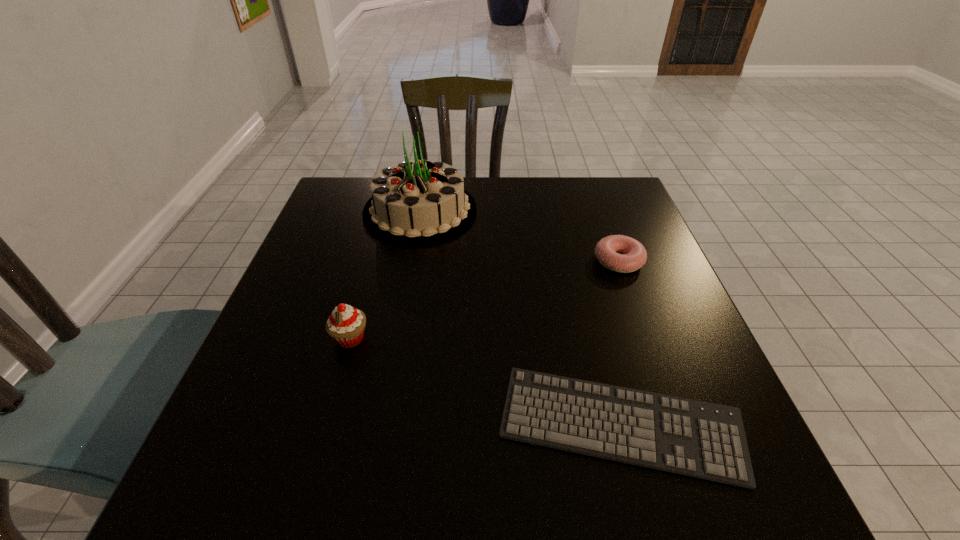
In the image, there is a desktop. At what (x,y) coordinates should I click in order to perform the action: click on vacant space at the left edge. Please return your answer as a coordinate pair (x, y). The image size is (960, 540). Looking at the image, I should click on (339, 239).

At what (x,y) coordinates should I click in order to perform the action: click on vacant space at the right edge of the desktop. Please return your answer as a coordinate pair (x, y). Image resolution: width=960 pixels, height=540 pixels. Looking at the image, I should click on (648, 378).

This screenshot has height=540, width=960. I want to click on vacant region at the far right corner of the desktop, so click(618, 185).

Identify the location of free space between the birthday cake and the cupcake. (385, 275).

In order to click on empty space that is in between the doughnut and the second nearest object in this screenshot , I will do `click(485, 299)`.

You are a GUI agent. You are given a task and a screenshot of the screen. Output one action in this format:
    pyautogui.click(x=<x>, y=<y>)
    Task: Click on the unoccupied area between the third farthest object and the nearest object
    
    Given the screenshot: What is the action you would take?
    pyautogui.click(x=485, y=382)

The image size is (960, 540). Identify the location of empty location between the cupcake and the computer keyboard. (485, 382).

Identify the location of unoccupied area between the shortest object and the birthday cake. coord(520,318).

At what (x,y) coordinates should I click in order to perform the action: click on free space between the cupcake and the tallest object. Please return your answer as a coordinate pair (x, y). The image size is (960, 540). Looking at the image, I should click on (385, 275).

The image size is (960, 540). In order to click on unoccupied position between the doughnut and the birthday cake in this screenshot , I will do `click(519, 236)`.